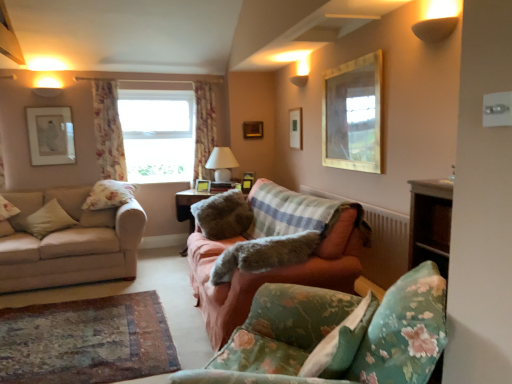
Question: Is there a large distance between beige fabric couch at left, which is the first studio couch in left-to-right order, and floral fabric curtain at center, the 2th curtain viewed from the left?

Choices:
 (A) no
 (B) yes

Answer: (B)

Question: Is beige fabric couch at left, placed as the third studio couch when sorted from right to left, positioned in front of floral fabric curtain at center, which is the second curtain from front to back?

Choices:
 (A) no
 (B) yes

Answer: (B)

Question: Does beige fabric couch at left, placed as the third studio couch when sorted from right to left, have a greater height compared to floral fabric curtain at center, which is counted as the first curtain, starting from the back?

Choices:
 (A) no
 (B) yes

Answer: (A)

Question: Is beige fabric couch at left, which is the first studio couch in left-to-right order, located outside floral fabric curtain at center, the 2th curtain viewed from the left?

Choices:
 (A) no
 (B) yes

Answer: (B)

Question: Is beige fabric couch at left, placed as the third studio couch when sorted from right to left, facing away from floral fabric curtain at center, which is the second curtain from front to back?

Choices:
 (A) no
 (B) yes

Answer: (A)

Question: Based on their positions, is floral fabric curtain at upper left, placed as the first curtain when sorted from front to back, located to the left or right of floral fabric curtain at center, which is the second curtain from front to back?

Choices:
 (A) right
 (B) left

Answer: (B)

Question: Looking at the image, does floral fabric curtain at upper left, placed as the first curtain when sorted from front to back, seem bigger or smaller compared to floral fabric curtain at center, which is counted as the first curtain, starting from the back?

Choices:
 (A) big
 (B) small

Answer: (B)

Question: Considering the positions of floral fabric curtain at upper left, the 2th curtain in the back-to-front sequence, and floral fabric curtain at center, the 1th curtain in the right-to-left sequence, in the image, is floral fabric curtain at upper left, the 2th curtain in the back-to-front sequence, wider or thinner than floral fabric curtain at center, the 1th curtain in the right-to-left sequence,?

Choices:
 (A) wide
 (B) thin

Answer: (B)

Question: Do you think floral fabric curtain at upper left, marked as the first curtain in a left-to-right arrangement, is within floral fabric curtain at center, the 2th curtain viewed from the left, or outside of it?

Choices:
 (A) outside
 (B) inside

Answer: (A)

Question: Is wooden picture frame at center, the 1th picture frame viewed from the back, inside the boundaries of floral fabric curtain at upper left, arranged as the second curtain when viewed from the right, or outside?

Choices:
 (A) inside
 (B) outside

Answer: (B)

Question: Is wooden picture frame at center, which ranks as the 3th picture frame in right-to-left order, wider or thinner than floral fabric curtain at upper left, the 2th curtain in the back-to-front sequence?

Choices:
 (A) thin
 (B) wide

Answer: (A)

Question: Is wooden picture frame at center, which appears as the 4th picture frame when viewed from the left, taller or shorter than floral fabric curtain at upper left, the 2th curtain in the back-to-front sequence?

Choices:
 (A) tall
 (B) short

Answer: (B)

Question: From a real-world perspective, is wooden picture frame at center, the 1th picture frame viewed from the back, above or below floral fabric curtain at upper left, marked as the first curtain in a left-to-right arrangement?

Choices:
 (A) below
 (B) above

Answer: (B)

Question: Is fluffy white pillow at left, placed as the 4th pillow when sorted from front to back, in front of or behind floral fabric pillow at lower right, which ranks as the 1th pillow in right-to-left order, in the image?

Choices:
 (A) behind
 (B) front

Answer: (A)

Question: In terms of size, does fluffy white pillow at left, placed as the 4th pillow when sorted from front to back, appear bigger or smaller than floral fabric pillow at lower right, which is the fourth pillow in back-to-front order?

Choices:
 (A) small
 (B) big

Answer: (B)